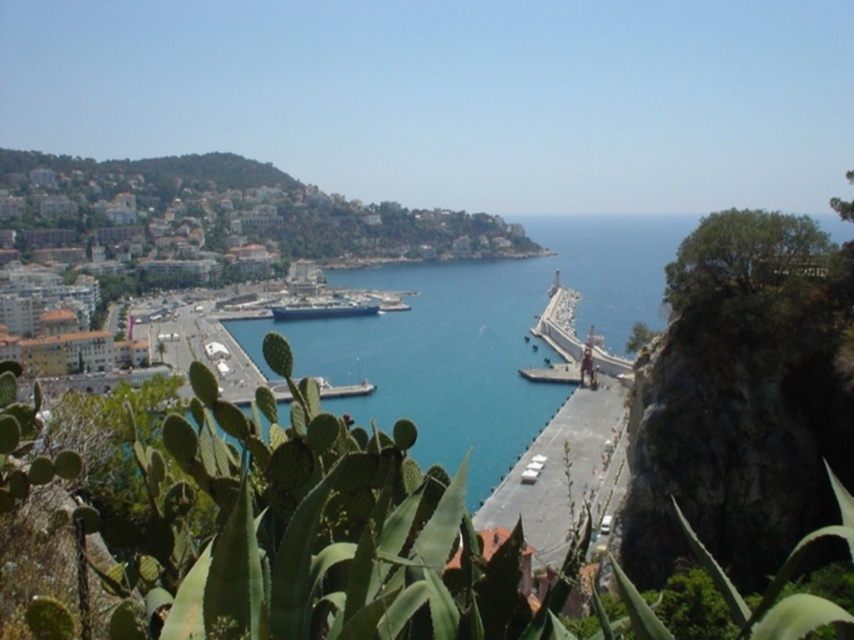
Question: Can you confirm if green spiny cactus at lower left is thinner than blue metallic cruise ship at center?

Choices:
 (A) no
 (B) yes

Answer: (A)

Question: Is green spiny cactus at lower left to the left of blue metallic cruise ship at center from the viewer's perspective?

Choices:
 (A) no
 (B) yes

Answer: (A)

Question: Is green spiny cactus at lower left smaller than blue metallic cruise ship at center?

Choices:
 (A) yes
 (B) no

Answer: (B)

Question: Which object is closer to the camera taking this photo?

Choices:
 (A) green spiny cactus at lower left
 (B) blue water at center

Answer: (A)

Question: Among these points, which one is farthest from the camera?

Choices:
 (A) (571, 556)
 (B) (373, 308)
 (C) (354, 365)

Answer: (B)

Question: Which object is farther from the camera taking this photo?

Choices:
 (A) green spiny cactus at lower left
 (B) blue water at center

Answer: (B)